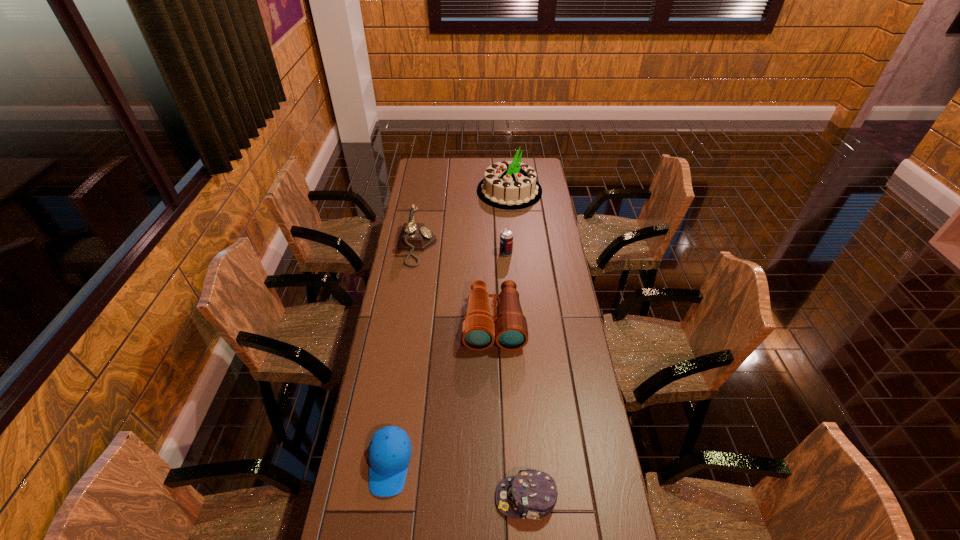
Locate an element on the screen. the farthest object is located at coordinates (511, 185).

What are the coordinates of `birthday cake` in the screenshot? It's located at (511, 185).

Where is `the second tallest object`? The width and height of the screenshot is (960, 540). the second tallest object is located at coordinates (414, 236).

Locate an element on the screen. The width and height of the screenshot is (960, 540). binoculars is located at coordinates (479, 329).

The image size is (960, 540). In order to click on beer can in this screenshot , I will do `click(506, 236)`.

Locate an element on the screen. Image resolution: width=960 pixels, height=540 pixels. the left headwear is located at coordinates (389, 453).

Where is `the right headwear`? the right headwear is located at coordinates (532, 494).

The image size is (960, 540). What are the coordinates of `vacant region located on the left of the farthest object` in the screenshot? It's located at (439, 191).

Identify the location of free location located on the dial of the second tallest object. (492, 247).

I want to click on vacant region located 0.110m through the lenses of the binoculars, so click(495, 377).